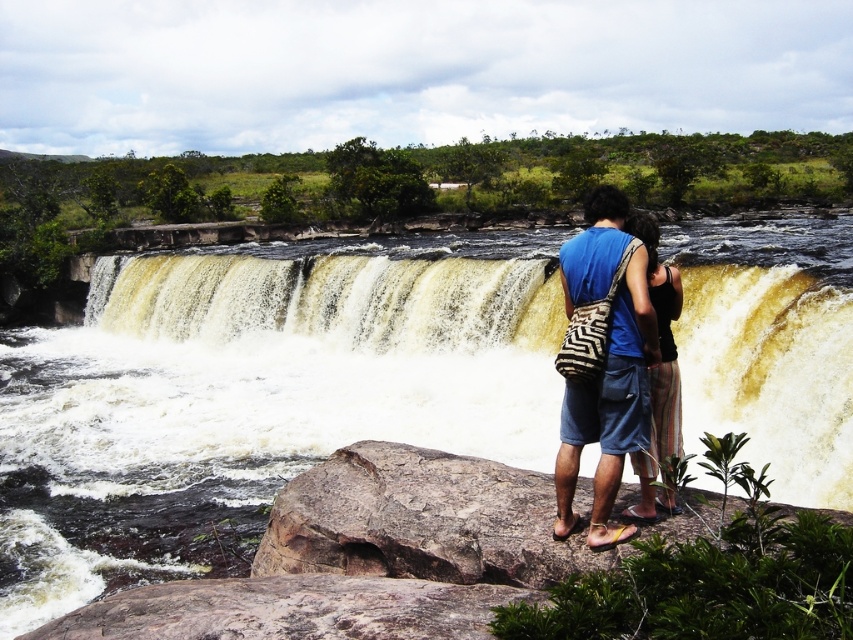
Does brown textured water at center lie behind blue cotton shirt at center?

Yes, it is behind blue cotton shirt at center.

Who is higher up, brown textured water at center or blue cotton shirt at center?

brown textured water at center is above.

Looking at this image, who is more distant from viewer, (x=212, y=573) or (x=590, y=250)?

The point (x=212, y=573) is more distant.

What are the coordinates of `brown textured water at center` in the screenshot? It's located at (254, 394).

Is brown textured water at center to the left of brown rough rock at center from the viewer's perspective?

Indeed, brown textured water at center is positioned on the left side of brown rough rock at center.

Who is taller, brown textured water at center or brown rough rock at center?

Standing taller between the two is brown textured water at center.

This screenshot has height=640, width=853. What do you see at coordinates (254, 394) in the screenshot? I see `brown textured water at center` at bounding box center [254, 394].

Locate an element on the screen. This screenshot has height=640, width=853. brown textured water at center is located at coordinates (254, 394).

Is brown rough rock at center wider than blue cotton shirt at center?

No.

Which of these two, brown rough rock at center or blue cotton shirt at center, stands taller?

Standing taller between the two is blue cotton shirt at center.

Identify the location of brown rough rock at center. (425, 520).